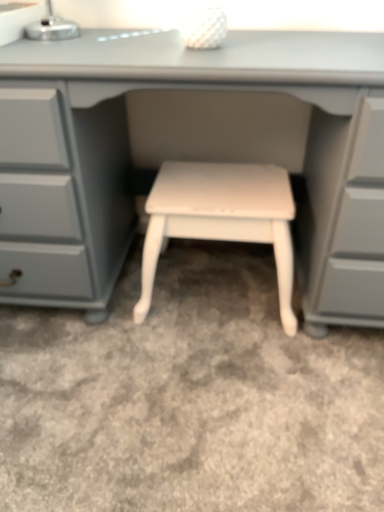
Locate an element on the screen. This screenshot has height=512, width=384. free space in front of matte gray desk at center is located at coordinates (180, 407).